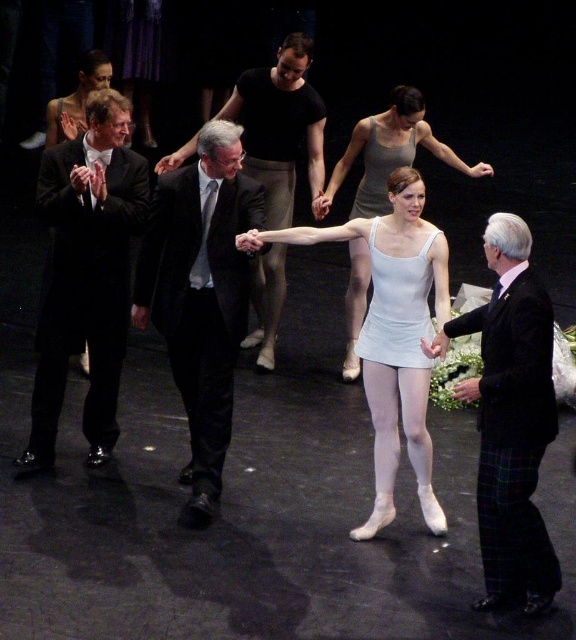
Can you confirm if black satin suit at left is wider than white satin leotard at center?

In fact, black satin suit at left might be narrower than white satin leotard at center.

The image size is (576, 640). What do you see at coordinates (85, 275) in the screenshot?
I see `black satin suit at left` at bounding box center [85, 275].

Between point (47, 310) and point (374, 371), which one is positioned behind?

The point (47, 310) is behind.

Locate an element on the screen. This screenshot has width=576, height=640. black satin suit at left is located at coordinates (85, 275).

Is point (373, 371) positioned behind point (433, 332)?

That is True.

Identify the location of white satin leotard at center. This screenshot has width=576, height=640. (392, 333).

Is white satin leotard at center wider than dark gray suit at center?

Indeed, white satin leotard at center has a greater width compared to dark gray suit at center.

Which is more to the right, white satin leotard at center or dark gray suit at center?

Positioned to the right is white satin leotard at center.

Which is in front, point (420, 244) or point (289, 180)?

Point (420, 244) is in front.

You are a GUI agent. You are given a task and a screenshot of the screen. Output one action in this format:
    pyautogui.click(x=<x>, y=<y>)
    Task: Click on the white satin leotard at center
    This screenshot has height=640, width=576.
    Given the screenshot: What is the action you would take?
    point(392,333)